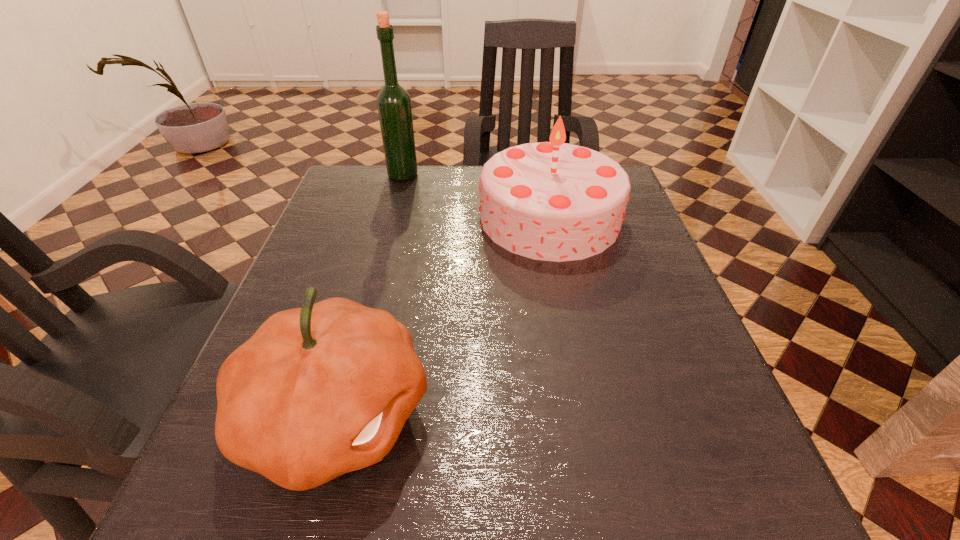
Identify the location of object that is the second nearest to the liquor. (318, 391).

Find the location of a particular element. The height and width of the screenshot is (540, 960). object that can be found as the closest to the tallest object is located at coordinates (553, 201).

Locate an element on the screen. vacant space that satisfies the following two spatial constraints: 1. on the front side of the rightmost object; 2. on the right side of the tallest object is located at coordinates (392, 217).

Locate an element on the screen. The width and height of the screenshot is (960, 540). vacant space that satisfies the following two spatial constraints: 1. on the front side of the liquor; 2. on the front face of the shortest object is located at coordinates (341, 414).

Locate an element on the screen. Image resolution: width=960 pixels, height=540 pixels. blank space that satisfies the following two spatial constraints: 1. on the front side of the tallest object; 2. on the front face of the shortest object is located at coordinates (341, 414).